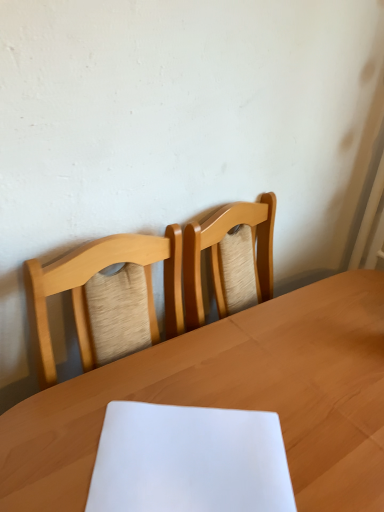
Identify the location of vacant area on the back side of white paper at center. coord(189,366).